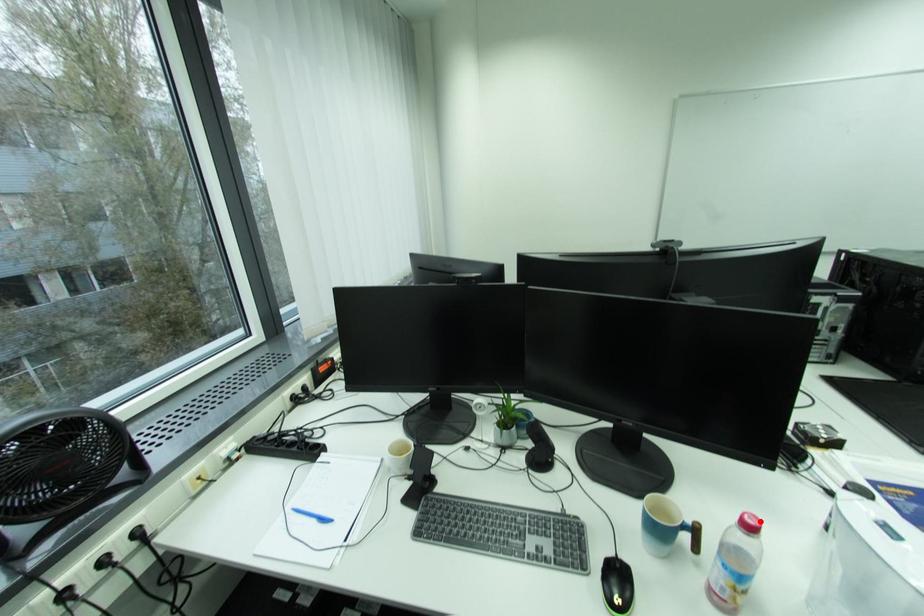
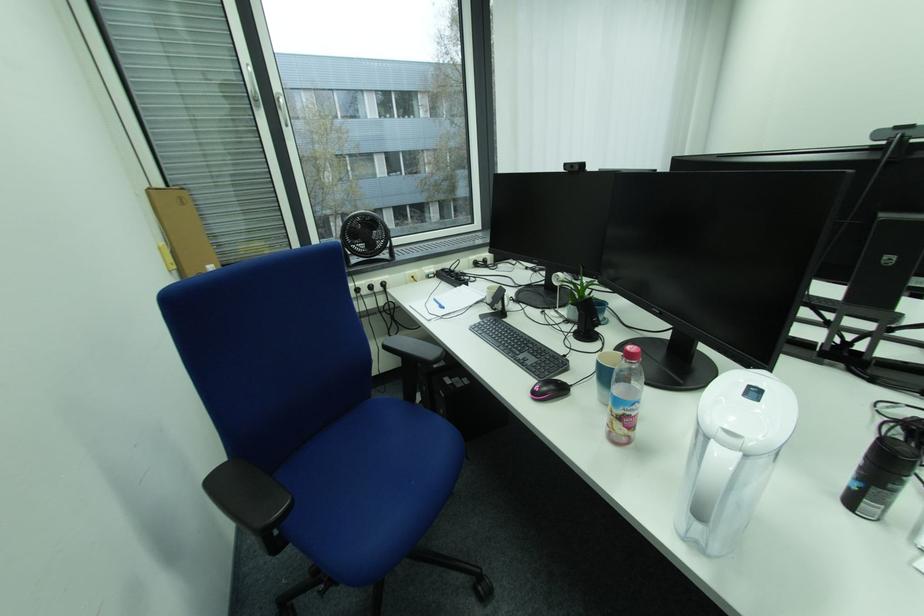
Question: I am providing you with two images of the same scene from different viewpoints. Image1 has a red point marked. In image2, the corresponding 3D location appears at what relative position? Reply with the corresponding letter.

Choices:
 (A) Closer
 (B) Farther

Answer: (A)